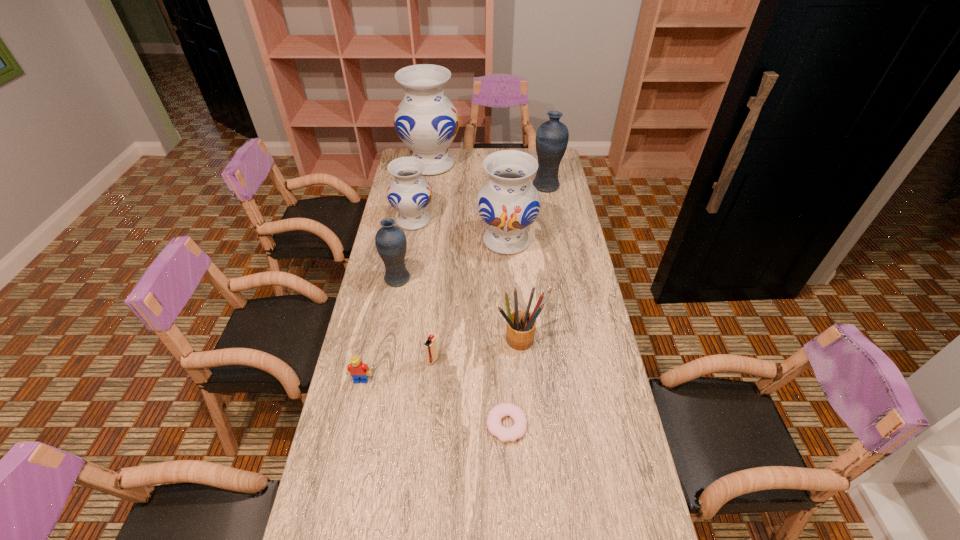
The width and height of the screenshot is (960, 540). What are the coordinates of `the tallest object` in the screenshot? It's located at (427, 122).

Locate an element on the screen. The image size is (960, 540). the tallest vase is located at coordinates (427, 122).

Find the location of a particular element. the rightmost vase is located at coordinates (552, 136).

This screenshot has width=960, height=540. Identify the location of the rightmost object. (552, 136).

Locate an element on the screen. The image size is (960, 540). the second smallest red vase is located at coordinates (508, 204).

Where is `the rightmost red vase`? the rightmost red vase is located at coordinates (508, 204).

Where is `the left blue vase`? The image size is (960, 540). the left blue vase is located at coordinates (390, 240).

The height and width of the screenshot is (540, 960). Identify the location of the nearest vase. (390, 240).

Locate an element on the screen. the smallest red vase is located at coordinates (410, 194).

Find the location of a particular element. The width and height of the screenshot is (960, 540). brown pencil box is located at coordinates (520, 330).